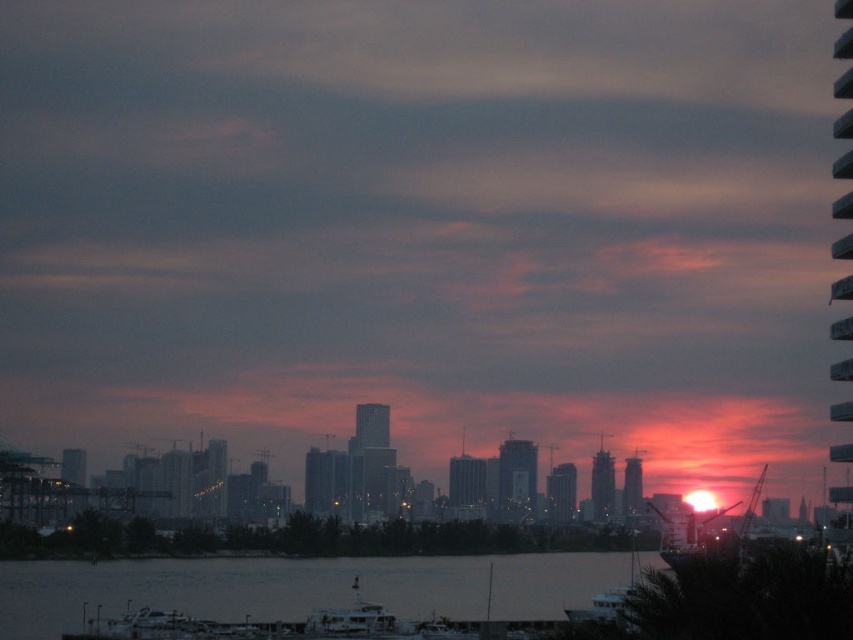
You are standing at the waterfront looking at the city skyline. There are two points marked in the image, one at coordinate point (44, 598) and another at point (605, 602). Which point is closer to your eyes?

Point (44, 598) is further to the camera than point (605, 602), so the point closer to your eyes is point (605, 602).

You are standing on the dock and see the silvery water at lower center and the metallic silver boat at lower center. Which object is closer to you?

The silvery water at lower center is closer to you because the metallic silver boat at lower center is positioned behind it.